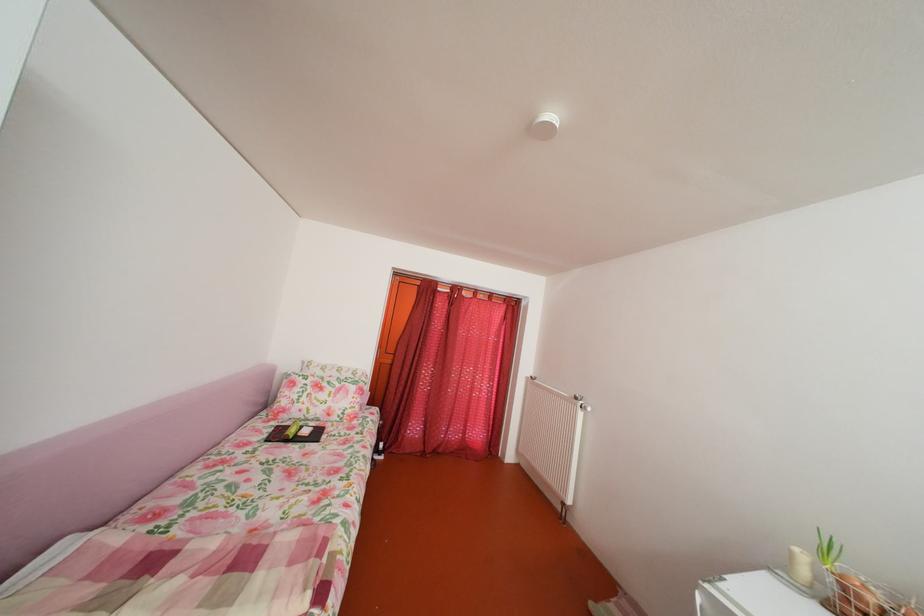
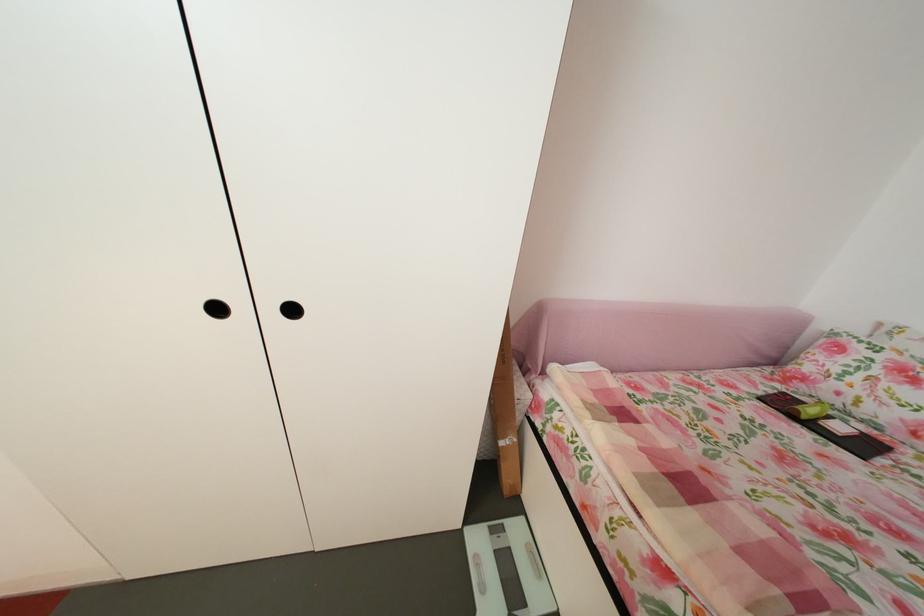
Where in the second image is the point corresponding to point (311, 416) from the first image?

(849, 400)